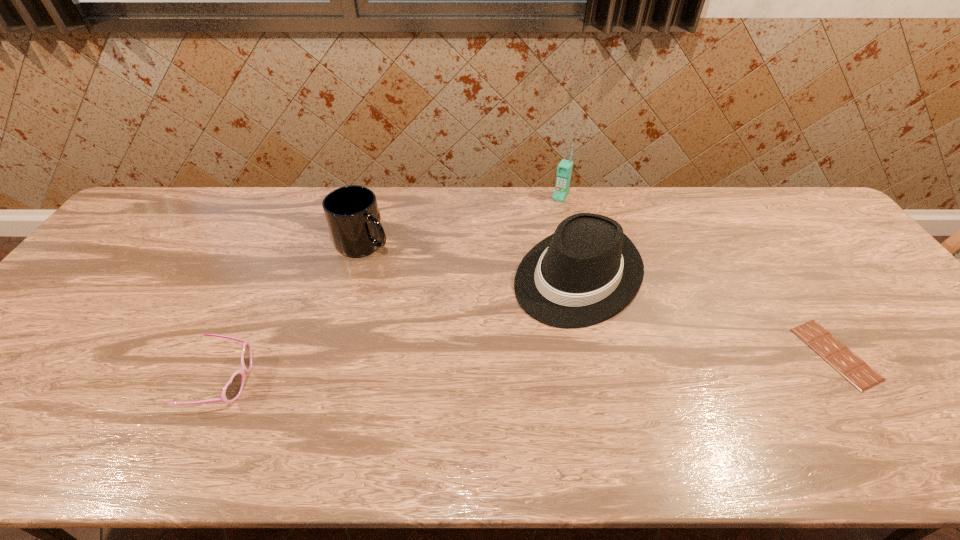
Find the location of a particular element. vacant space that's between the second shortest object and the fourth object from right to left is located at coordinates (295, 312).

At what (x,y) coordinates should I click in order to perform the action: click on free space between the leftmost object and the shortest object. Please return your answer as a coordinate pair (x, y). Looking at the image, I should click on (530, 367).

Find the location of a particular element. The height and width of the screenshot is (540, 960). free space between the fedora and the leftmost object is located at coordinates (402, 328).

The image size is (960, 540). What are the coordinates of `vacant space in between the shortest object and the fedora` in the screenshot? It's located at (708, 315).

Locate an element on the screen. The image size is (960, 540). free point between the fedora and the mug is located at coordinates (471, 259).

Identify the location of vacant area that lies between the chocolate bar and the cellular telephone. Image resolution: width=960 pixels, height=540 pixels. (x=698, y=275).

Where is `vacant area that lies between the farthest object and the leftmost object`? The height and width of the screenshot is (540, 960). vacant area that lies between the farthest object and the leftmost object is located at coordinates (393, 289).

Find the location of a particular element. free space between the mug and the sunglasses is located at coordinates (295, 312).

Image resolution: width=960 pixels, height=540 pixels. In order to click on object that stands as the second closest to the second object from left to right in this screenshot , I will do `click(588, 270)`.

Select which object is the second closest to the rightmost object. Please provide its 2D coordinates. Your answer should be formatted as a tuple, i.e. [(x, y)], where the tuple contains the x and y coordinates of a point satisfying the conditions above.

[(564, 169)]